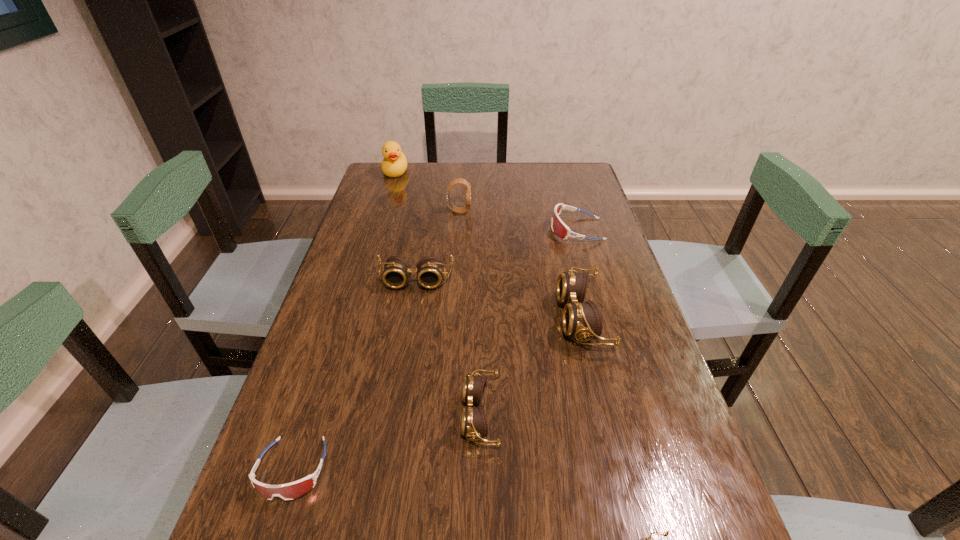
Where is `vacant region at the right edge of the desktop`? This screenshot has width=960, height=540. vacant region at the right edge of the desktop is located at coordinates (677, 446).

Locate an element on the screen. This screenshot has height=540, width=960. vacant area between the second smallest brown goggles and the watch is located at coordinates 469,313.

Locate an element on the screen. free space between the right red goggles and the third farthest brown goggles is located at coordinates (528, 322).

Find the location of `empty space between the tallest goggles and the watch`. empty space between the tallest goggles and the watch is located at coordinates (520, 265).

What are the coordinates of `free space between the farthest goggles and the watch` in the screenshot? It's located at (517, 220).

Find the location of a particular element. The image size is (960, 540). free space between the duck and the second brown goggles from left to right is located at coordinates (438, 293).

The width and height of the screenshot is (960, 540). What are the coordinates of `vacant space that is in between the watch and the second brown goggles from left to right` in the screenshot? It's located at (469, 313).

Locate an element on the screen. The image size is (960, 540). blank region between the watch and the leftmost goggles is located at coordinates (375, 340).

This screenshot has height=540, width=960. Identify the location of object identified as the fourth closest to the second nearest brown goggles. click(430, 269).

Locate an element on the screen. object that ranks as the fourth closest to the duck is located at coordinates (580, 320).